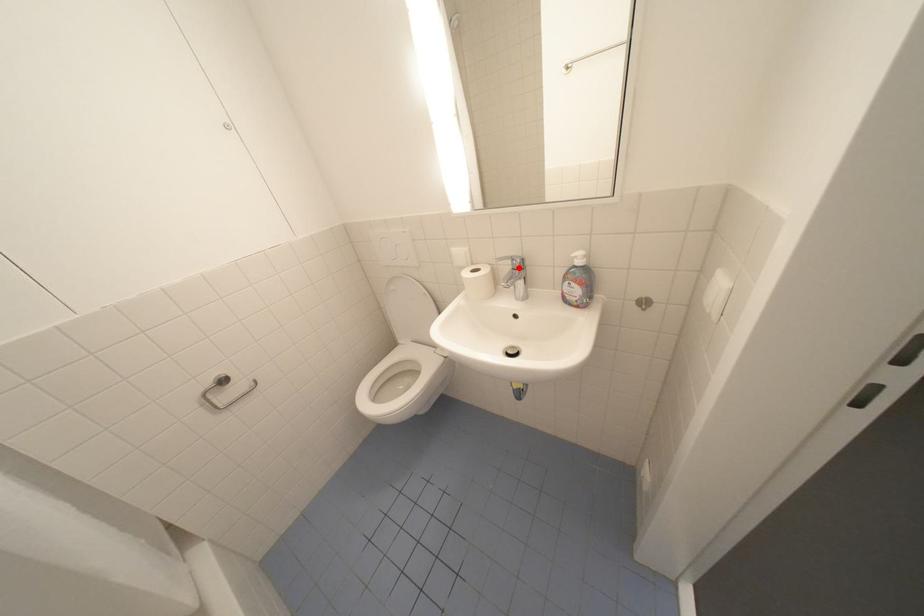
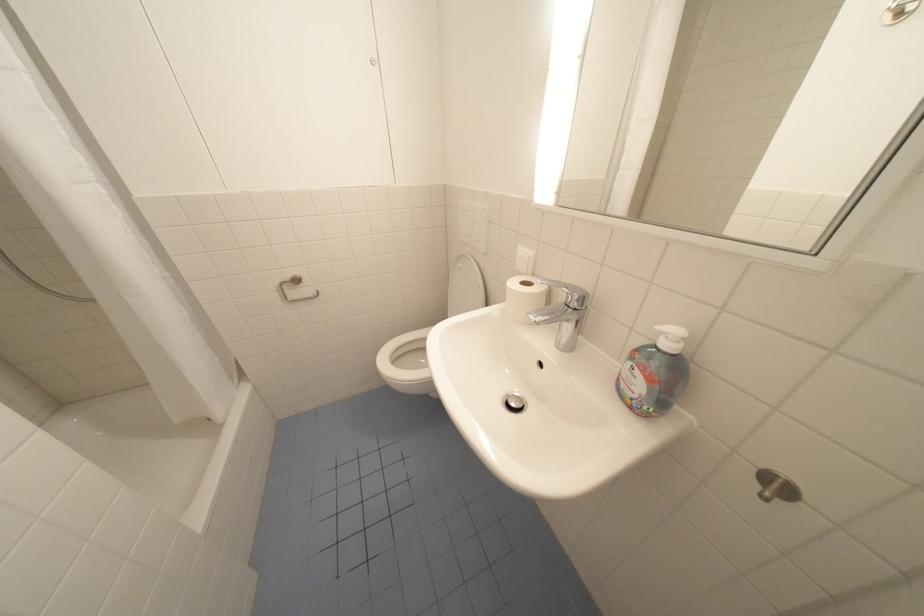
Question: I am providing you with two images of the same scene from different viewpoints. A red point is marked on the first image. At the location where the point appears in image 1, is it still visible in image 2?

Choices:
 (A) Yes
 (B) No

Answer: (A)